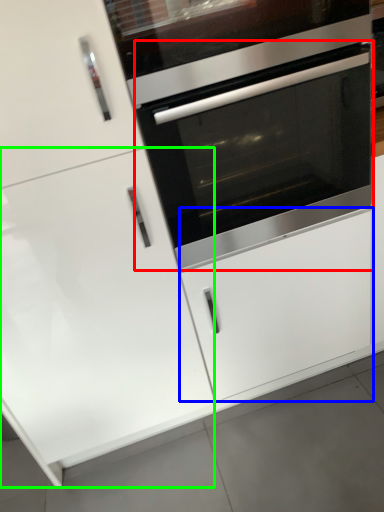
Question: Which object is the closest to the oven (highlighted by a red box)? Choose among these: drawer (highlighted by a blue box) or door (highlighted by a green box).

Choices:
 (A) drawer
 (B) door

Answer: (A)